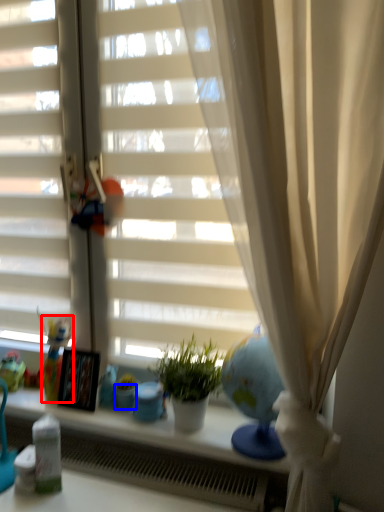
Question: Which object is further to the camera taking this photo, doll (highlighted by a red box) or glass vase (highlighted by a blue box)?

Choices:
 (A) doll
 (B) glass vase

Answer: (A)